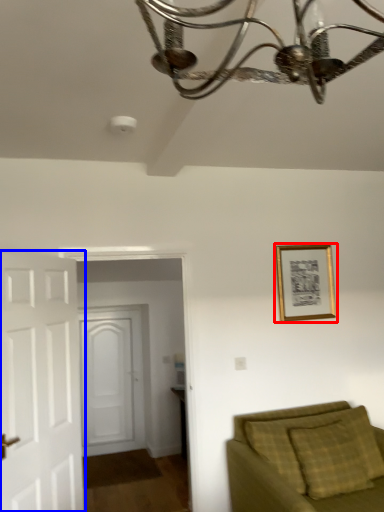
Question: Which object appears farthest to the camera in this image, picture frame (highlighted by a red box) or door (highlighted by a blue box)?

Choices:
 (A) picture frame
 (B) door

Answer: (A)